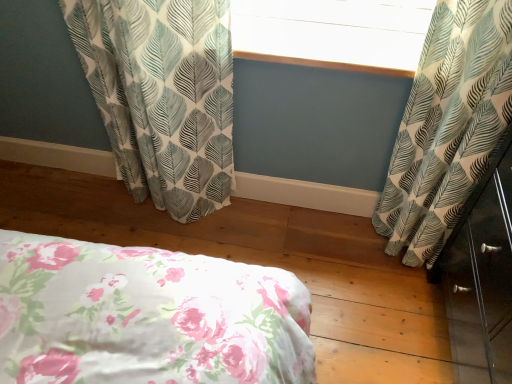
Where is `vacant space to the left of white leaf-patterned curtain at left, marked as the first curtain in a left-to-right arrangement`? This screenshot has height=384, width=512. vacant space to the left of white leaf-patterned curtain at left, marked as the first curtain in a left-to-right arrangement is located at coordinates (99, 211).